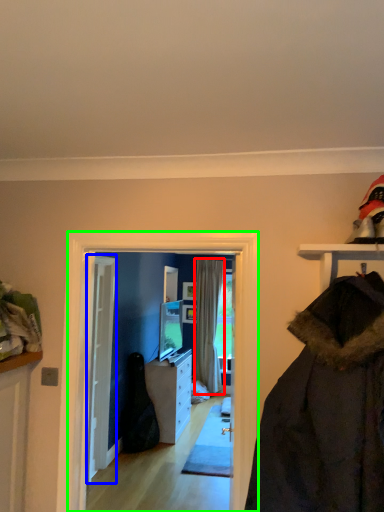
Question: Considering the real-world distances, which object is farthest from curtain (highlighted by a red box)? door (highlighted by a blue box) or screen door (highlighted by a green box)?

Choices:
 (A) door
 (B) screen door

Answer: (B)